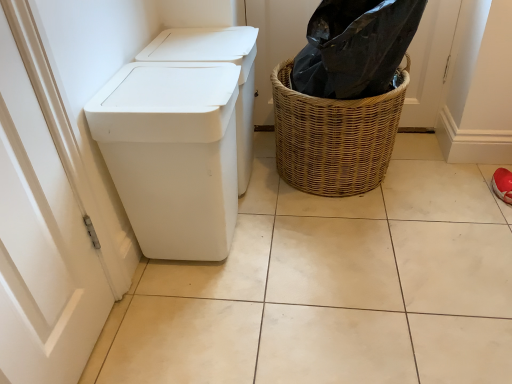
Question: Considering the relative sizes of white plastic waste container at left and woven brown basket at right in the image provided, is white plastic waste container at left bigger than woven brown basket at right?

Choices:
 (A) no
 (B) yes

Answer: (A)

Question: From the image's perspective, is white plastic waste container at left above woven brown basket at right?

Choices:
 (A) no
 (B) yes

Answer: (A)

Question: Is white plastic waste container at left not near woven brown basket at right?

Choices:
 (A) no
 (B) yes

Answer: (A)

Question: Can you confirm if white plastic waste container at left is smaller than woven brown basket at right?

Choices:
 (A) yes
 (B) no

Answer: (A)

Question: From a real-world perspective, does white plastic waste container at left sit lower than woven brown basket at right?

Choices:
 (A) no
 (B) yes

Answer: (A)

Question: Can you confirm if white plastic waste container at left is thinner than woven brown basket at right?

Choices:
 (A) no
 (B) yes

Answer: (B)

Question: Is woven brown basket at right far away from white matte tile at center?

Choices:
 (A) no
 (B) yes

Answer: (A)

Question: Is woven brown basket at right looking in the opposite direction of white matte tile at center?

Choices:
 (A) no
 (B) yes

Answer: (A)

Question: Does woven brown basket at right have a greater height compared to white matte tile at center?

Choices:
 (A) yes
 (B) no

Answer: (A)

Question: Is woven brown basket at right wider than white matte tile at center?

Choices:
 (A) no
 (B) yes

Answer: (A)

Question: From the image's perspective, is woven brown basket at right located above white matte tile at center?

Choices:
 (A) yes
 (B) no

Answer: (A)

Question: Can you confirm if woven brown basket at right is thinner than white matte tile at center?

Choices:
 (A) yes
 (B) no

Answer: (A)

Question: Is woven brown basket at right next to white plastic waste container at left and touching it?

Choices:
 (A) yes
 (B) no

Answer: (B)